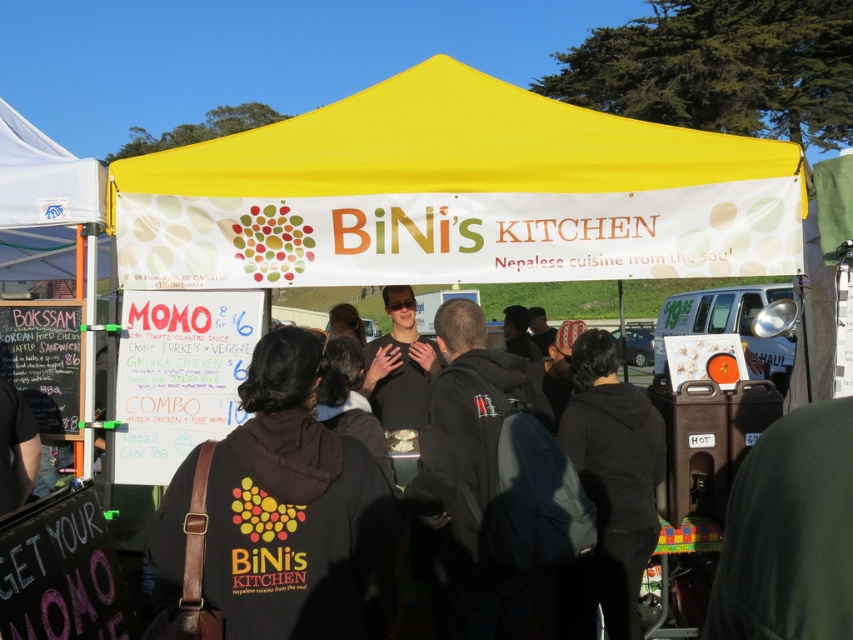
Does yellow fabric canopy at center have a greater height compared to black fabric crowd at center?

No.

Who is positioned more to the right, yellow fabric canopy at center or black fabric crowd at center?

black fabric crowd at center is more to the right.

Who is more distant from viewer, (x=550, y=256) or (x=505, y=353)?

Positioned behind is point (x=550, y=256).

The image size is (853, 640). Find the location of `yellow fabric canopy at center`. yellow fabric canopy at center is located at coordinates (456, 195).

Is yellow fabric canopy at center to the right of dark brown hoodie at center from the viewer's perspective?

Correct, you'll find yellow fabric canopy at center to the right of dark brown hoodie at center.

Does yellow fabric canopy at center have a greater height compared to dark brown hoodie at center?

Yes, yellow fabric canopy at center is taller than dark brown hoodie at center.

Identify the location of yellow fabric canopy at center. Image resolution: width=853 pixels, height=640 pixels. (456, 195).

Locate an element on the screen. The image size is (853, 640). yellow fabric canopy at center is located at coordinates (456, 195).

Can you confirm if dark brown hoodie at center is thinner than black fleece jacket at center?

Incorrect, dark brown hoodie at center's width is not less than black fleece jacket at center's.

Between dark brown hoodie at center and black fleece jacket at center, which one appears on the right side from the viewer's perspective?

From the viewer's perspective, black fleece jacket at center appears more on the right side.

Locate an element on the screen. This screenshot has width=853, height=640. dark brown hoodie at center is located at coordinates (277, 518).